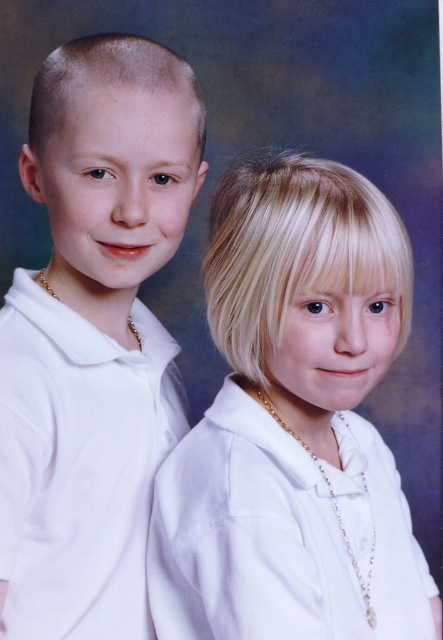
Between point (309, 520) and point (131, 358), which one is positioned in front?

Point (309, 520) is more forward.

Image resolution: width=443 pixels, height=640 pixels. Describe the element at coordinates (294, 424) in the screenshot. I see `blonde hair at center` at that location.

Where is `blonde hair at center`? Image resolution: width=443 pixels, height=640 pixels. blonde hair at center is located at coordinates (294, 424).